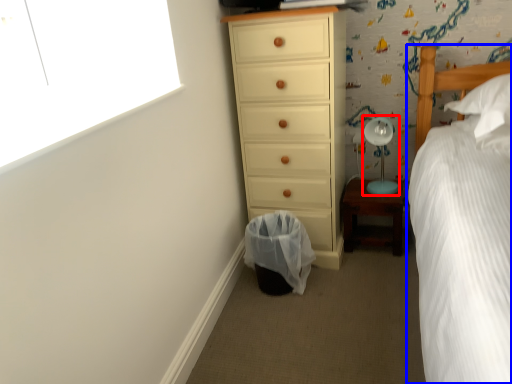
Question: Which point is closer to the camera, table lamp (highlighted by a red box) or bed (highlighted by a blue box)?

Choices:
 (A) table lamp
 (B) bed

Answer: (B)